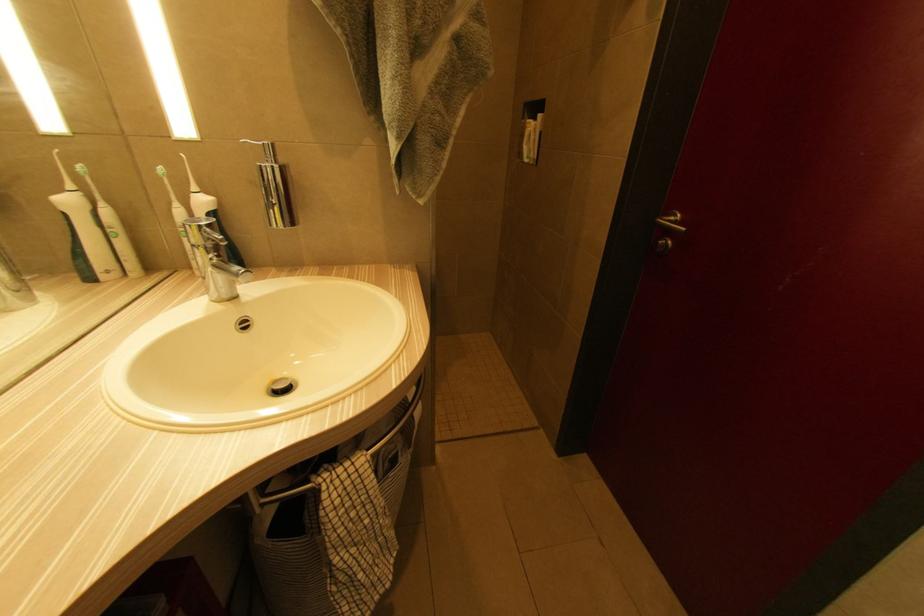
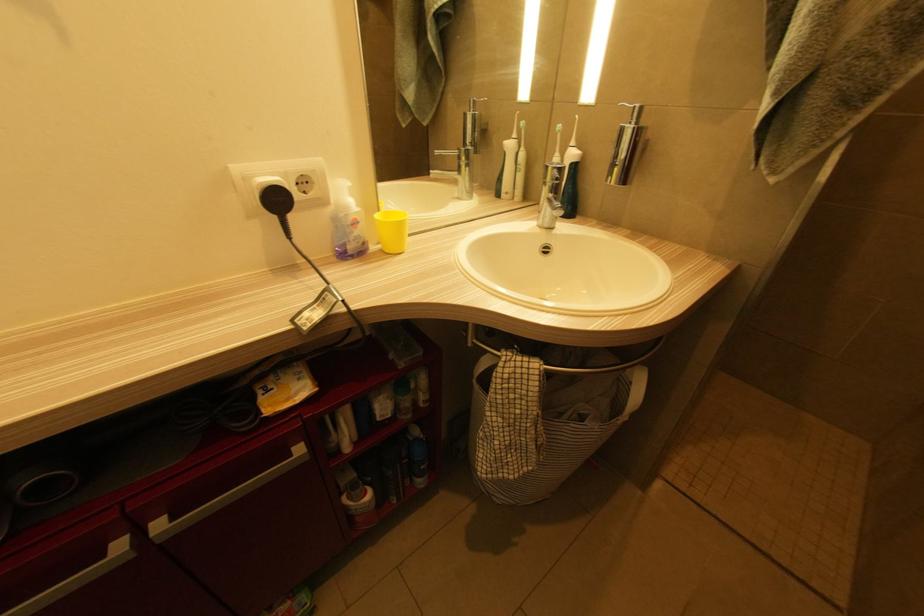
Question: The camera is either moving clockwise (left) or counter-clockwise (right) around the object. The first image is from the beginning of the video and the second image is from the end. Is the camera moving left or right when shooting the video?

Choices:
 (A) Left
 (B) Right

Answer: (B)